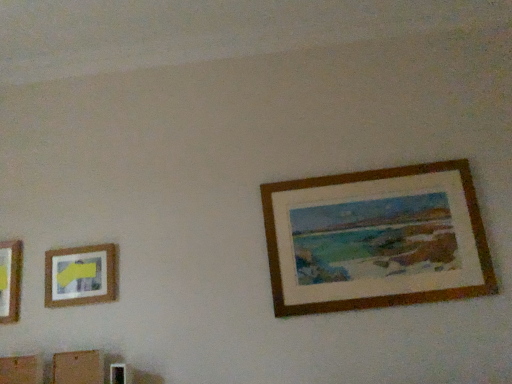
Image resolution: width=512 pixels, height=384 pixels. Describe the element at coordinates (376, 239) in the screenshot. I see `wooden picture frame at upper right, acting as the 1th picture frame starting from the right` at that location.

Where is `wooden picture frame at upper right, which ranks as the second picture frame in left-to-right order`? Image resolution: width=512 pixels, height=384 pixels. wooden picture frame at upper right, which ranks as the second picture frame in left-to-right order is located at coordinates (376, 239).

Measure the distance between matte wooden picture frame at left, arranged as the first picture frame when viewed from the left, and camera.

A distance of 7.46 feet exists between matte wooden picture frame at left, arranged as the first picture frame when viewed from the left, and camera.

This screenshot has width=512, height=384. What do you see at coordinates (80, 275) in the screenshot?
I see `matte wooden picture frame at left, marked as the 2th picture frame in a right-to-left arrangement` at bounding box center [80, 275].

The width and height of the screenshot is (512, 384). What are the coordinates of `matte wooden picture frame at left, marked as the 2th picture frame in a right-to-left arrangement` in the screenshot? It's located at (80, 275).

Measure the distance between point (61, 274) and camera.

The depth of point (61, 274) is 7.63 feet.

Find the location of a particular element. wooden picture frame at upper right, acting as the 1th picture frame starting from the right is located at coordinates (376, 239).

Considering the positions of objects matte wooden picture frame at left, arranged as the first picture frame when viewed from the left, and wooden picture frame at upper right, which ranks as the second picture frame in left-to-right order, in the image provided, who is more to the left, matte wooden picture frame at left, arranged as the first picture frame when viewed from the left, or wooden picture frame at upper right, which ranks as the second picture frame in left-to-right order,?

Positioned to the left is matte wooden picture frame at left, arranged as the first picture frame when viewed from the left.

Does matte wooden picture frame at left, arranged as the first picture frame when viewed from the left, come in front of wooden picture frame at upper right, which ranks as the second picture frame in left-to-right order?

That is False.

Is point (106, 297) positioned in front of point (382, 291)?

That is False.

From the image's perspective, is matte wooden picture frame at left, arranged as the first picture frame when viewed from the left, over wooden picture frame at upper right, which ranks as the second picture frame in left-to-right order?

No, from the image's perspective, matte wooden picture frame at left, arranged as the first picture frame when viewed from the left, is not on top of wooden picture frame at upper right, which ranks as the second picture frame in left-to-right order.

From a real-world perspective, is matte wooden picture frame at left, marked as the 2th picture frame in a right-to-left arrangement, physically below wooden picture frame at upper right, which ranks as the second picture frame in left-to-right order?

Yes, from a real-world perspective, matte wooden picture frame at left, marked as the 2th picture frame in a right-to-left arrangement, is beneath wooden picture frame at upper right, which ranks as the second picture frame in left-to-right order.

Considering the sizes of objects matte wooden picture frame at left, marked as the 2th picture frame in a right-to-left arrangement, and wooden picture frame at upper right, which ranks as the second picture frame in left-to-right order, in the image provided, who is thinner, matte wooden picture frame at left, marked as the 2th picture frame in a right-to-left arrangement, or wooden picture frame at upper right, which ranks as the second picture frame in left-to-right order,?

Thinner between the two is matte wooden picture frame at left, marked as the 2th picture frame in a right-to-left arrangement.

Can you confirm if matte wooden picture frame at left, arranged as the first picture frame when viewed from the left, is taller than wooden picture frame at upper right, which ranks as the second picture frame in left-to-right order?

No.

Considering the relative sizes of matte wooden picture frame at left, arranged as the first picture frame when viewed from the left, and wooden picture frame at upper right, acting as the 1th picture frame starting from the right, in the image provided, is matte wooden picture frame at left, arranged as the first picture frame when viewed from the left, smaller than wooden picture frame at upper right, acting as the 1th picture frame starting from the right,?

Correct, matte wooden picture frame at left, arranged as the first picture frame when viewed from the left, occupies less space than wooden picture frame at upper right, acting as the 1th picture frame starting from the right.

Is matte wooden picture frame at left, arranged as the first picture frame when viewed from the left, not within wooden picture frame at upper right, which ranks as the second picture frame in left-to-right order?

Yes, matte wooden picture frame at left, arranged as the first picture frame when viewed from the left, is not within wooden picture frame at upper right, which ranks as the second picture frame in left-to-right order.

Is matte wooden picture frame at left, marked as the 2th picture frame in a right-to-left arrangement, placed right next to wooden picture frame at upper right, which ranks as the second picture frame in left-to-right order?

No.

Could you tell me if matte wooden picture frame at left, marked as the 2th picture frame in a right-to-left arrangement, is facing wooden picture frame at upper right, acting as the 1th picture frame starting from the right?

No, matte wooden picture frame at left, marked as the 2th picture frame in a right-to-left arrangement, is not facing towards wooden picture frame at upper right, acting as the 1th picture frame starting from the right.

Can you tell me how much matte wooden picture frame at left, arranged as the first picture frame when viewed from the left, and wooden picture frame at upper right, acting as the 1th picture frame starting from the right, differ in facing direction?

0.371 degrees.

How much distance is there between matte wooden picture frame at left, arranged as the first picture frame when viewed from the left, and wooden picture frame at upper right, acting as the 1th picture frame starting from the right?

matte wooden picture frame at left, arranged as the first picture frame when viewed from the left, is 1.25 meters away from wooden picture frame at upper right, acting as the 1th picture frame starting from the right.

Find the location of `picture frame below the wooden picture frame at upper right, acting as the 1th picture frame starting from the right (from the image's perspective)`. picture frame below the wooden picture frame at upper right, acting as the 1th picture frame starting from the right (from the image's perspective) is located at coordinates (80, 275).

Considering the relative positions of wooden picture frame at upper right, which ranks as the second picture frame in left-to-right order, and matte wooden picture frame at left, marked as the 2th picture frame in a right-to-left arrangement, in the image provided, is wooden picture frame at upper right, which ranks as the second picture frame in left-to-right order, to the left or to the right of matte wooden picture frame at left, marked as the 2th picture frame in a right-to-left arrangement,?

wooden picture frame at upper right, which ranks as the second picture frame in left-to-right order, is positioned on matte wooden picture frame at left, marked as the 2th picture frame in a right-to-left arrangement,'s right side.

Does wooden picture frame at upper right, acting as the 1th picture frame starting from the right, come in front of matte wooden picture frame at left, marked as the 2th picture frame in a right-to-left arrangement?

Yes, it is in front of matte wooden picture frame at left, marked as the 2th picture frame in a right-to-left arrangement.

Is point (290, 220) behind point (62, 288)?

No, it is not.

From the image's perspective, is wooden picture frame at upper right, acting as the 1th picture frame starting from the right, over matte wooden picture frame at left, arranged as the first picture frame when viewed from the left?

Yes, from the image's perspective, wooden picture frame at upper right, acting as the 1th picture frame starting from the right, is over matte wooden picture frame at left, arranged as the first picture frame when viewed from the left.

From a real-world perspective, is wooden picture frame at upper right, acting as the 1th picture frame starting from the right, positioned under matte wooden picture frame at left, marked as the 2th picture frame in a right-to-left arrangement, based on gravity?

Incorrect, from a real-world perspective, wooden picture frame at upper right, acting as the 1th picture frame starting from the right, is higher than matte wooden picture frame at left, marked as the 2th picture frame in a right-to-left arrangement.

In terms of width, does wooden picture frame at upper right, acting as the 1th picture frame starting from the right, look wider or thinner when compared to matte wooden picture frame at left, arranged as the first picture frame when viewed from the left?

Clearly, wooden picture frame at upper right, acting as the 1th picture frame starting from the right, has more width compared to matte wooden picture frame at left, arranged as the first picture frame when viewed from the left.

Which of these two, wooden picture frame at upper right, acting as the 1th picture frame starting from the right, or matte wooden picture frame at left, marked as the 2th picture frame in a right-to-left arrangement, stands shorter?

matte wooden picture frame at left, marked as the 2th picture frame in a right-to-left arrangement, is shorter.

Between wooden picture frame at upper right, which ranks as the second picture frame in left-to-right order, and matte wooden picture frame at left, arranged as the first picture frame when viewed from the left, which one has smaller size?

matte wooden picture frame at left, arranged as the first picture frame when viewed from the left.

Is wooden picture frame at upper right, acting as the 1th picture frame starting from the right, situated inside matte wooden picture frame at left, arranged as the first picture frame when viewed from the left, or outside?

wooden picture frame at upper right, acting as the 1th picture frame starting from the right, is spatially situated outside matte wooden picture frame at left, arranged as the first picture frame when viewed from the left.

Is wooden picture frame at upper right, acting as the 1th picture frame starting from the right, with matte wooden picture frame at left, marked as the 2th picture frame in a right-to-left arrangement?

There is a gap between wooden picture frame at upper right, acting as the 1th picture frame starting from the right, and matte wooden picture frame at left, marked as the 2th picture frame in a right-to-left arrangement.

Consider the image. Is wooden picture frame at upper right, which ranks as the second picture frame in left-to-right order, positioned with its back to matte wooden picture frame at left, arranged as the first picture frame when viewed from the left?

No, wooden picture frame at upper right, which ranks as the second picture frame in left-to-right order, is not facing away from matte wooden picture frame at left, arranged as the first picture frame when viewed from the left.

Find the location of a particular element. Image resolution: width=512 pixels, height=384 pixels. picture frame lying on the right of matte wooden picture frame at left, arranged as the first picture frame when viewed from the left is located at coordinates (376, 239).

Where is `picture frame behind the wooden picture frame at upper right, acting as the 1th picture frame starting from the right`? picture frame behind the wooden picture frame at upper right, acting as the 1th picture frame starting from the right is located at coordinates (80, 275).

Where is `picture frame that appears above the matte wooden picture frame at left, arranged as the first picture frame when viewed from the left (from the image's perspective)`? This screenshot has height=384, width=512. picture frame that appears above the matte wooden picture frame at left, arranged as the first picture frame when viewed from the left (from the image's perspective) is located at coordinates (376, 239).